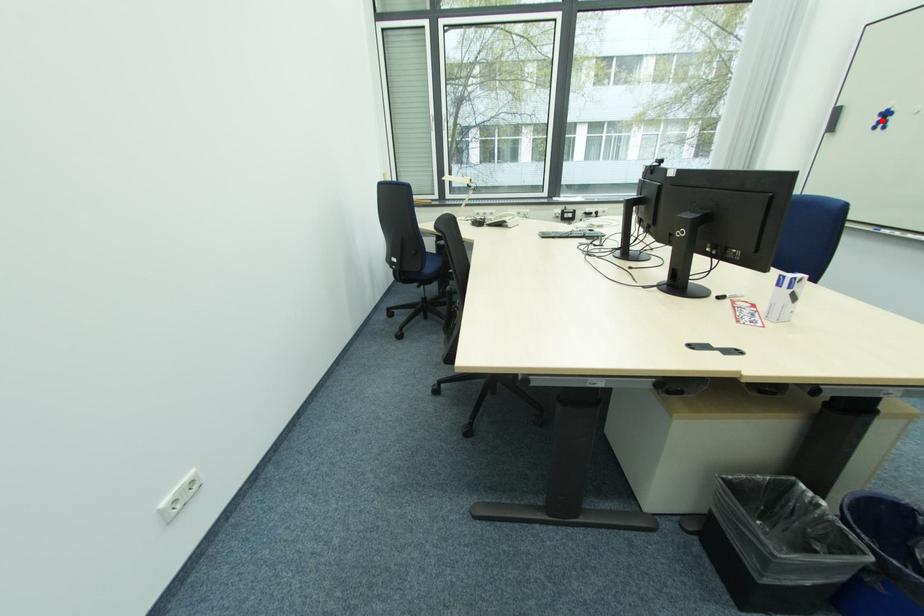
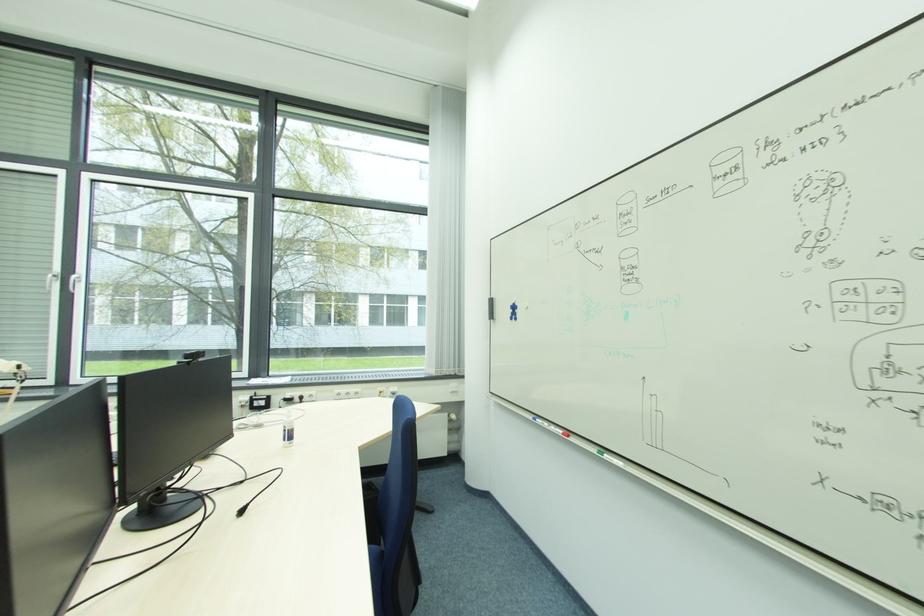
The point at the highlighted location is marked in the first image. Where is the corresponding point in the second image?

(515, 313)